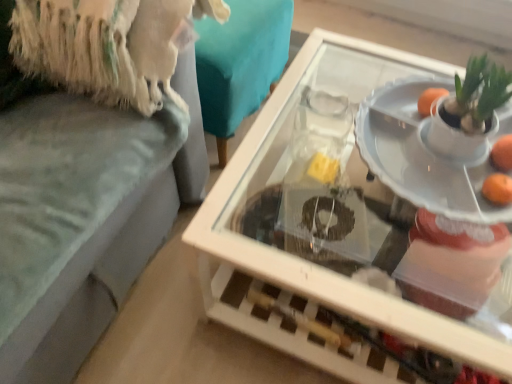
Where is `white glossy plate at center`? Image resolution: width=512 pixels, height=384 pixels. white glossy plate at center is located at coordinates (425, 154).

What do you see at coordinates (502, 153) in the screenshot?
I see `orange matte at right, which is the second orange from bottom to top` at bounding box center [502, 153].

Identify the location of orange matte at right, which is the second orange from bottom to top. (502, 153).

Identify the location of white glossy plate at center. (425, 154).

Considering the positions of point (496, 150) and point (246, 162), is point (496, 150) closer or farther from the camera than point (246, 162)?

Point (496, 150) appears to be closer to the viewer than point (246, 162).

From the image's perspective, relative to transparent glass table at center, is orange matte at right, which is the second orange from bottom to top, above or below?

orange matte at right, which is the second orange from bottom to top, is situated higher than transparent glass table at center in the image.

Is transparent glass table at center a part of orange matte at right, the second orange in the front-to-back sequence?

Actually, transparent glass table at center is outside orange matte at right, the second orange in the front-to-back sequence.

Is orange matte at right, the 1th orange when ordered from back to front, taller than orange matte at right, placed as the 2th orange when sorted from top to bottom?

Correct, orange matte at right, the 1th orange when ordered from back to front, is much taller as orange matte at right, placed as the 2th orange when sorted from top to bottom.

Is orange matte at right, acting as the first orange starting from the top, not near orange matte at right, placed as the 2th orange when sorted from top to bottom?

Actually, orange matte at right, acting as the first orange starting from the top, and orange matte at right, placed as the 2th orange when sorted from top to bottom, are a little close together.

Considering the positions of objects orange matte at right, acting as the first orange starting from the top, and orange matte at right, placed as the 2th orange when sorted from top to bottom, in the image provided, who is more to the right, orange matte at right, acting as the first orange starting from the top, or orange matte at right, placed as the 2th orange when sorted from top to bottom,?

Positioned to the right is orange matte at right, acting as the first orange starting from the top.

Is orange matte at right, the second orange in the front-to-back sequence, wider than orange matte at right, placed as the 2th orange when sorted from top to bottom?

Correct, the width of orange matte at right, the second orange in the front-to-back sequence, exceeds that of orange matte at right, placed as the 2th orange when sorted from top to bottom.

Is orange matte at right, which appears as the first orange when viewed from the front, thinner than white glossy plate at center?

Yes, orange matte at right, which appears as the first orange when viewed from the front, is thinner than white glossy plate at center.

Who is smaller, orange matte at right, placed as the 2th orange when sorted from back to front, or white glossy plate at center?

orange matte at right, placed as the 2th orange when sorted from back to front.

Based on the photo, can white glossy plate at center be found inside orange matte at right, the 1th orange positioned from the bottom?

That's incorrect, white glossy plate at center is not inside orange matte at right, the 1th orange positioned from the bottom.

From the image's perspective, which is below, orange matte at right, placed as the 2th orange when sorted from top to bottom, or white glossy plate at center?

orange matte at right, placed as the 2th orange when sorted from top to bottom, is shown below in the image.

What's the angular difference between transparent glass table at center and orange matte at right, placed as the 2th orange when sorted from top to bottom,'s facing directions?

The angular difference between transparent glass table at center and orange matte at right, placed as the 2th orange when sorted from top to bottom, is 1.01 degrees.

From a real-world perspective, which object stands above the other?

In real-world perspective, orange matte at right, placed as the 2th orange when sorted from top to bottom, is above.

Is point (507, 342) farther from camera compared to point (503, 178)?

Yes, point (507, 342) is behind point (503, 178).

Does transparent glass table at center turn towards orange matte at right, placed as the 2th orange when sorted from top to bottom?

No, transparent glass table at center is not aimed at orange matte at right, placed as the 2th orange when sorted from top to bottom.

Is white glossy plate at center facing towards orange matte at right, the 1th orange when ordered from back to front?

No, white glossy plate at center is not facing towards orange matte at right, the 1th orange when ordered from back to front.

Is orange matte at right, acting as the first orange starting from the top, inside white glossy plate at center?

That's correct, orange matte at right, acting as the first orange starting from the top, is inside white glossy plate at center.

From a real-world perspective, is white glossy plate at center above or below orange matte at right, which is the second orange from bottom to top?

white glossy plate at center is below orange matte at right, which is the second orange from bottom to top.

Considering the relative sizes of white glossy plate at center and orange matte at right, the second orange in the front-to-back sequence, in the image provided, is white glossy plate at center thinner than orange matte at right, the second orange in the front-to-back sequence,?

In fact, white glossy plate at center might be wider than orange matte at right, the second orange in the front-to-back sequence.

What's the angular difference between white glossy plate at center and orange matte at right, placed as the 2th orange when sorted from back to front,'s facing directions?

They differ by 0.000123 degrees in their facing directions.

Is white glossy plate at center turned away from orange matte at right, placed as the 2th orange when sorted from top to bottom?

white glossy plate at center does not have its back to orange matte at right, placed as the 2th orange when sorted from top to bottom.

From a real-world perspective, which is physically above, white glossy plate at center or orange matte at right, which appears as the first orange when viewed from the front?

In real-world perspective, orange matte at right, which appears as the first orange when viewed from the front, is above.

This screenshot has width=512, height=384. Identify the location of plate below the orange matte at right, placed as the 2th orange when sorted from back to front (from a real-world perspective). (425, 154).

Can you see transparent glass table at center touching white glossy plate at center?

No, transparent glass table at center is not beside white glossy plate at center.

In terms of width, does transparent glass table at center look wider or thinner when compared to white glossy plate at center?

Clearly, transparent glass table at center has more width compared to white glossy plate at center.

Is transparent glass table at center facing away from white glossy plate at center?

transparent glass table at center does not have its back to white glossy plate at center.

From a real-world perspective, relative to white glossy plate at center, is transparent glass table at center vertically above or below?

In terms of real-world spatial position, transparent glass table at center is below white glossy plate at center.

From the image's perspective, which orange is the 2nd one above the transparent glass table at center? Please provide its 2D coordinates.

[(502, 153)]

Locate an element on the screen. orange below the orange matte at right, the second orange in the front-to-back sequence (from the image's perspective) is located at coordinates (498, 189).

Based on their spatial positions, is transparent glass table at center or orange matte at right, placed as the 2th orange when sorted from top to bottom, further from white glossy plate at center?

The object further to white glossy plate at center is transparent glass table at center.

Looking at the image, which one is located further to transparent glass table at center, orange matte at right, which appears as the first orange when viewed from the front, or white glossy plate at center?

Based on the image, orange matte at right, which appears as the first orange when viewed from the front, appears to be further to transparent glass table at center.

Which object lies nearer to the anchor point orange matte at right, the 1th orange positioned from the bottom, orange matte at right, the 1th orange when ordered from back to front, or white glossy plate at center?

Based on the image, orange matte at right, the 1th orange when ordered from back to front, appears to be nearer to orange matte at right, the 1th orange positioned from the bottom.

Considering their positions, is white glossy plate at center positioned further to transparent glass table at center than orange matte at right, the 1th orange when ordered from back to front?

orange matte at right, the 1th orange when ordered from back to front, lies further to transparent glass table at center than the other object.

From the image, which object appears to be nearer to transparent glass table at center, orange matte at right, placed as the 2th orange when sorted from top to bottom, or orange matte at right, acting as the first orange starting from the top?

orange matte at right, placed as the 2th orange when sorted from top to bottom.

Which object lies further to the anchor point orange matte at right, the 1th orange when ordered from back to front, orange matte at right, placed as the 2th orange when sorted from back to front, or white glossy plate at center?

white glossy plate at center is positioned further to the anchor orange matte at right, the 1th orange when ordered from back to front.

Looking at the image, which one is located further to transparent glass table at center, orange matte at right, which is the second orange from bottom to top, or orange matte at right, which appears as the first orange when viewed from the front?

orange matte at right, which is the second orange from bottom to top, is positioned further to the anchor transparent glass table at center.

Estimate the real-world distances between objects in this image. Which object is further from white glossy plate at center, orange matte at right, the second orange in the front-to-back sequence, or transparent glass table at center?

transparent glass table at center is further to white glossy plate at center.

At what (x,y) coordinates should I click in order to perform the action: click on plate between transparent glass table at center and orange matte at right, which is the second orange from bottom to top, in the front-back direction. Please return your answer as a coordinate pair (x, y). The height and width of the screenshot is (384, 512). Looking at the image, I should click on (425, 154).

The height and width of the screenshot is (384, 512). In order to click on plate located between transparent glass table at center and orange matte at right, which appears as the first orange when viewed from the front, in the depth direction in this screenshot , I will do `click(425, 154)`.

This screenshot has width=512, height=384. In order to click on orange between white glossy plate at center and orange matte at right, the 1th orange when ordered from back to front, from left to right in this screenshot , I will do `click(498, 189)`.

The width and height of the screenshot is (512, 384). Identify the location of orange between transparent glass table at center and orange matte at right, acting as the first orange starting from the top, along the z-axis. (498, 189).